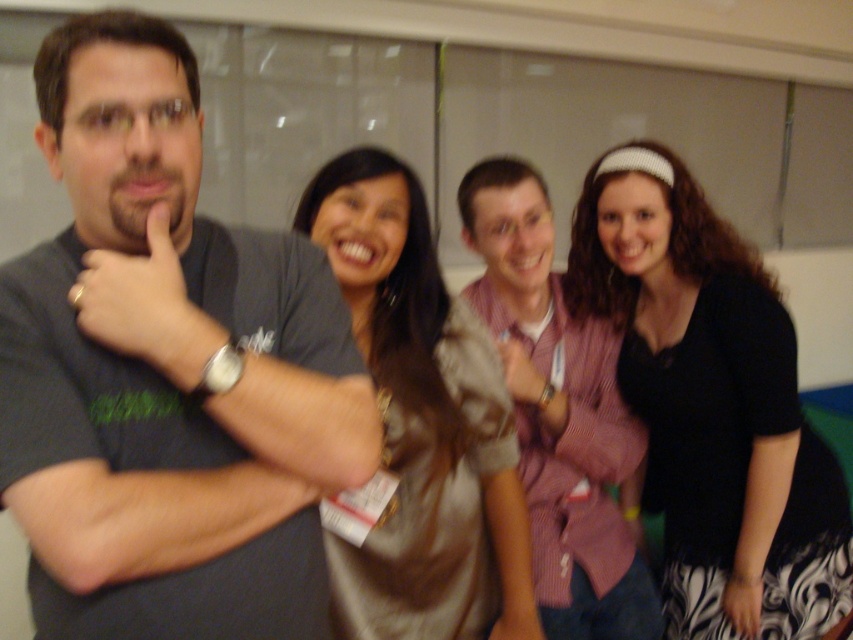
Based on the photo, you are standing in the room where the four people are posing. You need to determine which of the two points, point (753,304) or point (387,584), is closer to you. Which one is closer?

Point (753,304) is further to the viewer than point (387,584), so the closer point to you is point (387,584).

You are organizing a photo shoot and need to adjust the lighting to ensure that the black knit sweater at center and the black fabric at right are both visible. Since they are both black, how can you use their positions to help differentiate them in the final photo?

The black knit sweater at center is in front of the black fabric at right, so positioning the light source to create a shadow from the sweater onto the fabric will help differentiate them by showing the spatial relationship between the two objects.